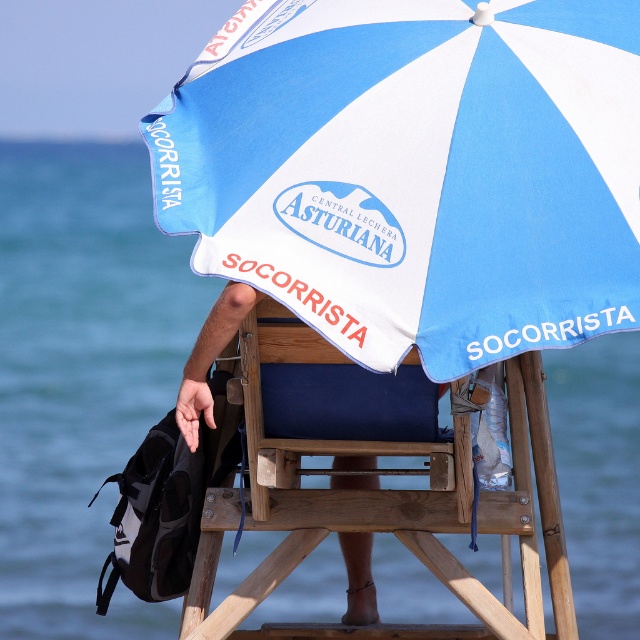
Question: Can you confirm if blue fabric umbrella at center is wider than wooden at center?

Choices:
 (A) yes
 (B) no

Answer: (A)

Question: Which object is closer to the camera taking this photo?

Choices:
 (A) wooden at center
 (B) blue fabric umbrella at center

Answer: (B)

Question: Among these points, which one is nearest to the camera?

Choices:
 (A) (321, 170)
 (B) (454, 531)

Answer: (A)

Question: Can you confirm if blue fabric umbrella at center is positioned above wooden at center?

Choices:
 (A) yes
 (B) no

Answer: (A)

Question: Is blue fabric umbrella at center below wooden at center?

Choices:
 (A) no
 (B) yes

Answer: (A)